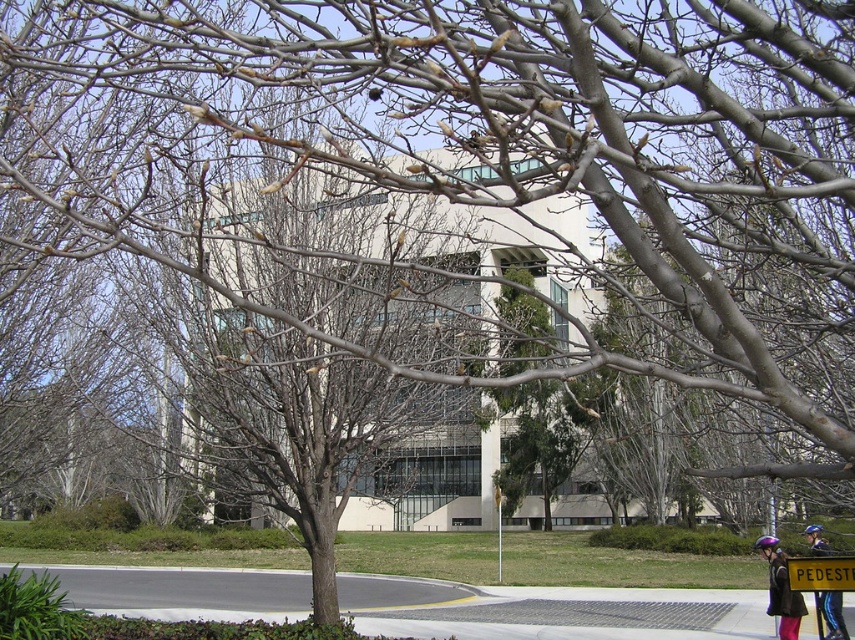
You are standing in front of the large modern building with a light beige facade and large glass windows. You see a point marked at coordinate (821, 573). What object is located at that point?

The point at coordinate (821, 573) indicates a yellow plastic sign at center.

You are standing at the center of the image. Which direction should you move to pick up the purple helmet at lower right?

You should move to the lower right direction to pick up the purple helmet at lower right since it is located at point (780, 589).